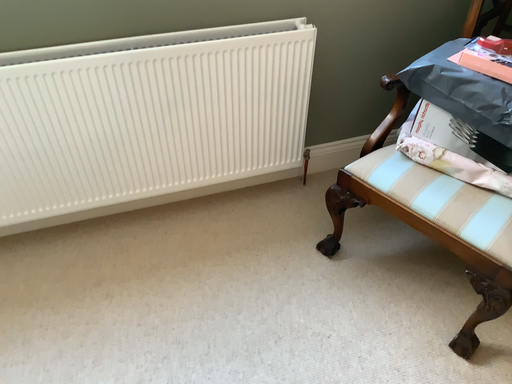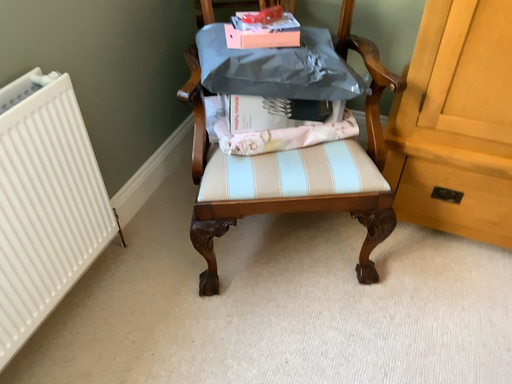
Question: How did the camera likely rotate when shooting the video?

Choices:
 (A) rotated downward
 (B) rotated upward

Answer: (B)